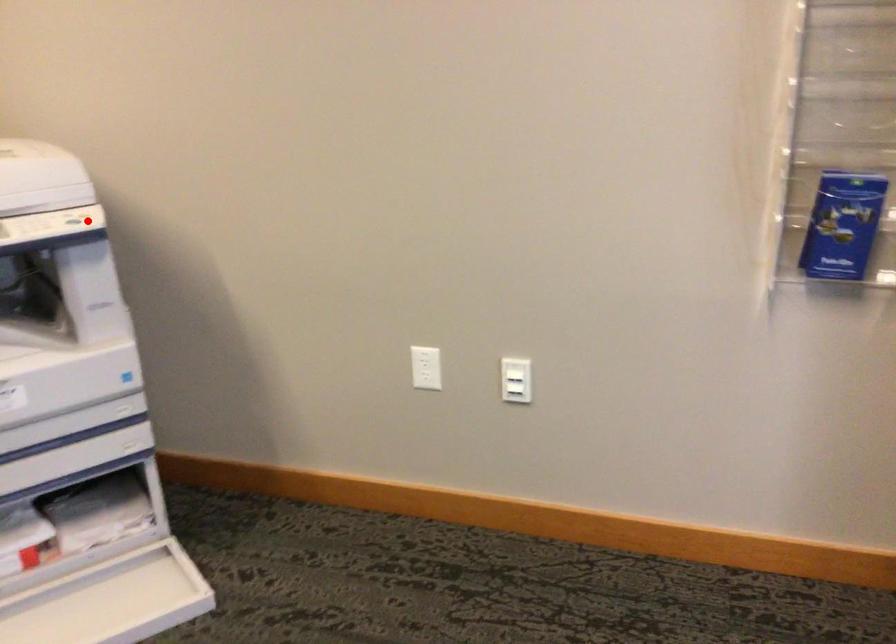
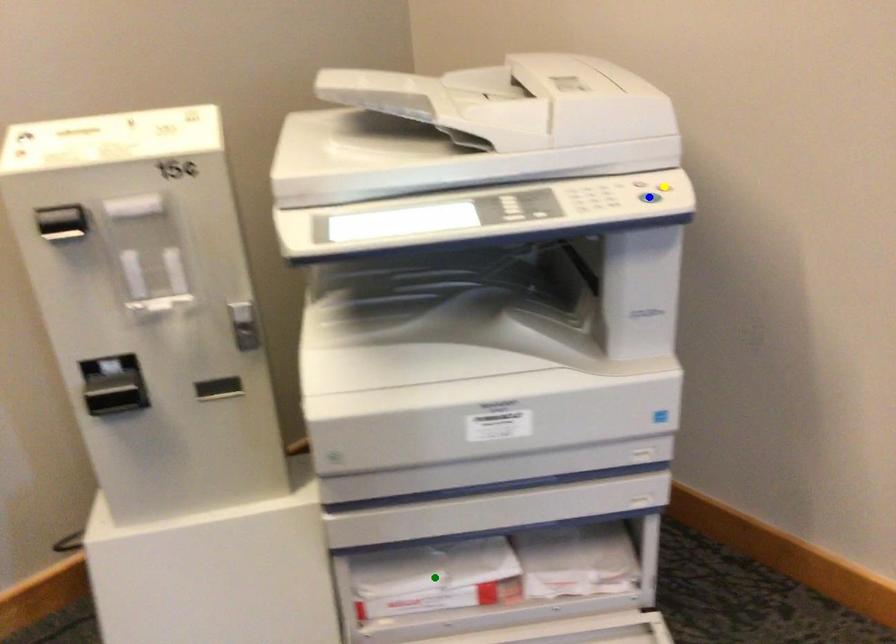
Question: I am providing you with two images of the same scene from different viewpoints. A red point is marked on the first image. You are given multiple points on the second image. Can you choose the point in image 2 that corresponds to the point in image 1?

Choices:
 (A) blue point
 (B) yellow point
 (C) green point

Answer: (A)